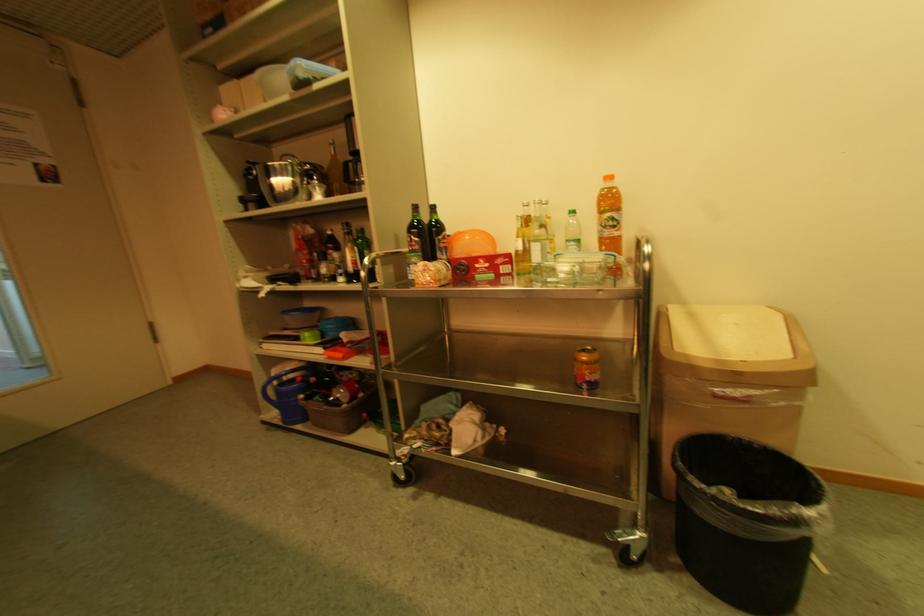
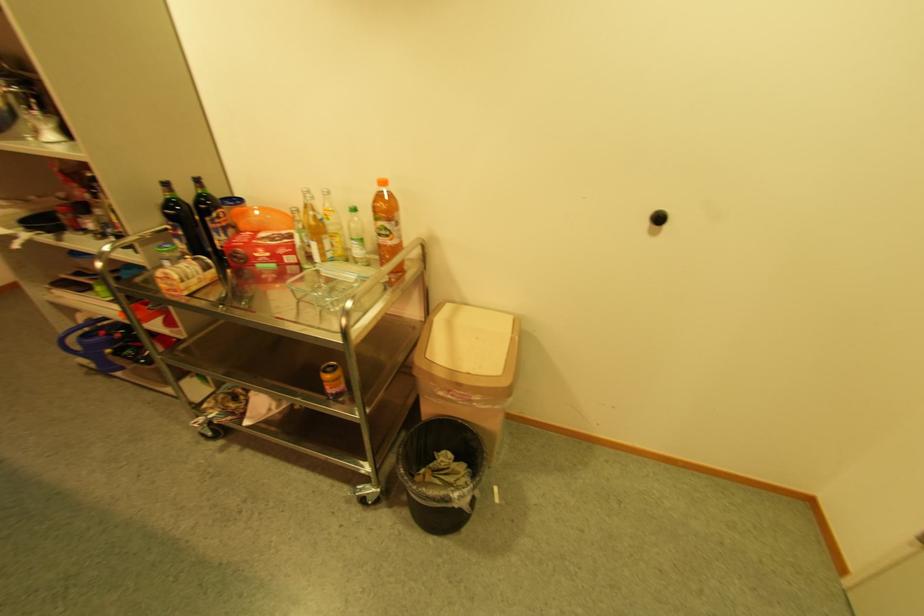
In the second image, find the point that corresponds to point (388, 265) in the first image.

(147, 248)